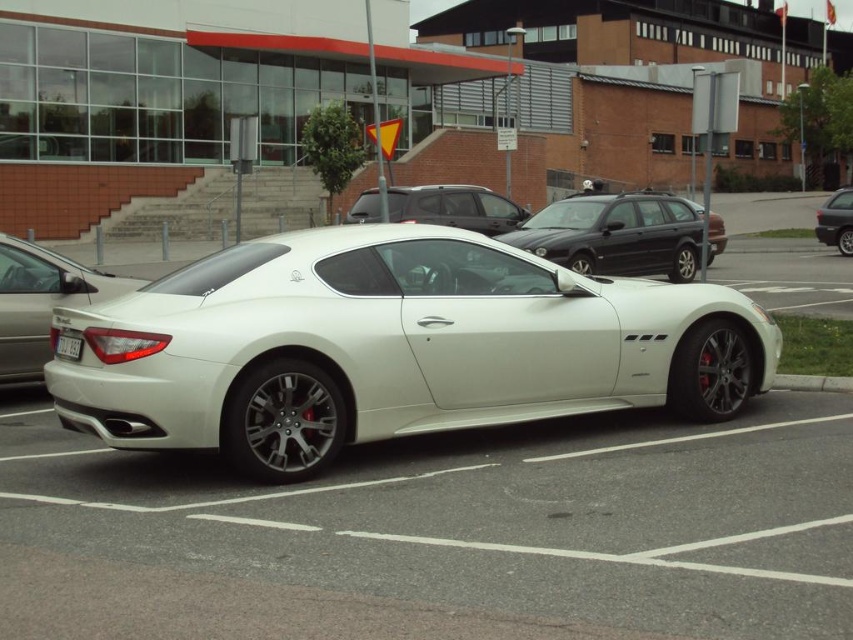
Does satin black suv at upper center have a larger size compared to white plastic license plate at center?

Yes.

Between point (474, 224) and point (68, 353), which one is positioned behind?

The point (474, 224) is behind.

Is point (395, 198) behind point (57, 349)?

Yes, point (395, 198) is behind point (57, 349).

Locate an element on the screen. satin black suv at upper center is located at coordinates (454, 208).

Is glossy black station wagon at center thinner than satin white car at center?

Indeed, glossy black station wagon at center has a lesser width compared to satin white car at center.

Measure the distance between glossy black station wagon at center and camera.

A distance of 13.75 meters exists between glossy black station wagon at center and camera.

Is point (572, 243) positioned after point (125, 292)?

Yes.

Where is `glossy black station wagon at center`? glossy black station wagon at center is located at coordinates [x=616, y=234].

Which is in front, point (761, 381) or point (16, 333)?

Point (761, 381) is more forward.

Does white metallic sports car at center have a greater width compared to satin white car at center?

Yes.

What do you see at coordinates (392, 346) in the screenshot? I see `white metallic sports car at center` at bounding box center [392, 346].

Locate an element on the screen. The image size is (853, 640). white metallic sports car at center is located at coordinates (392, 346).